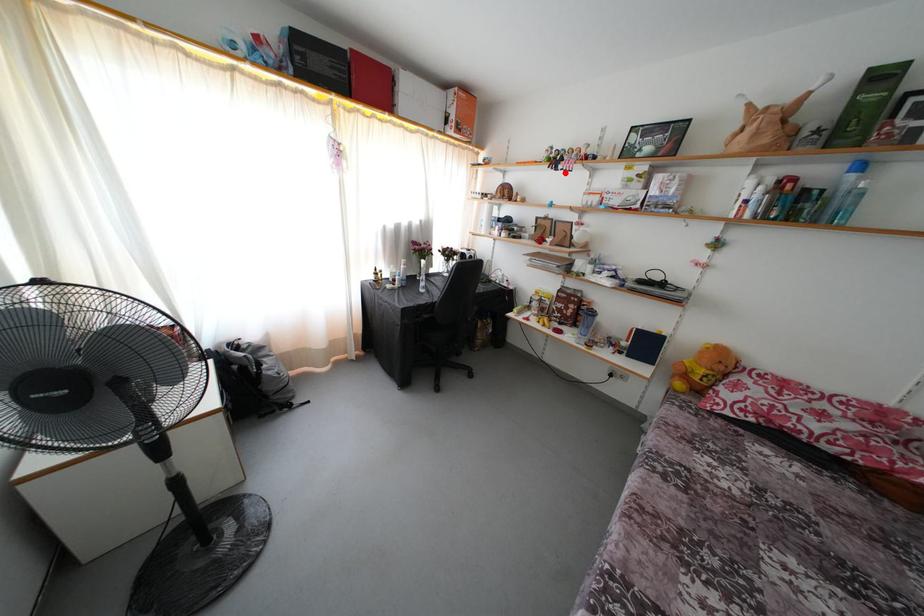
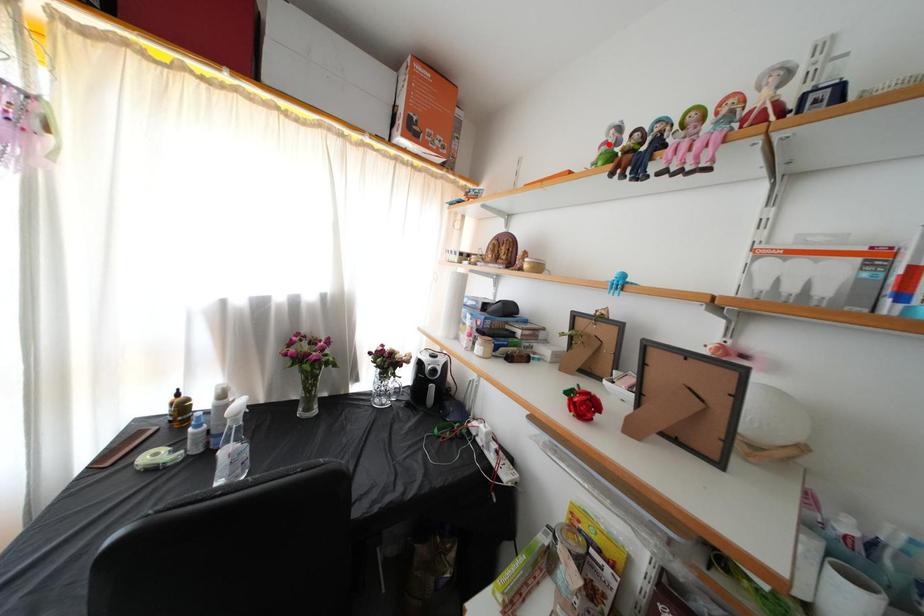
I am providing you with two images of the same scene from different viewpoints. A red point is marked on the first image and another point is marked on the second image. Do the highlighted points in image1 and image2 indicate the same real-world spot?

No